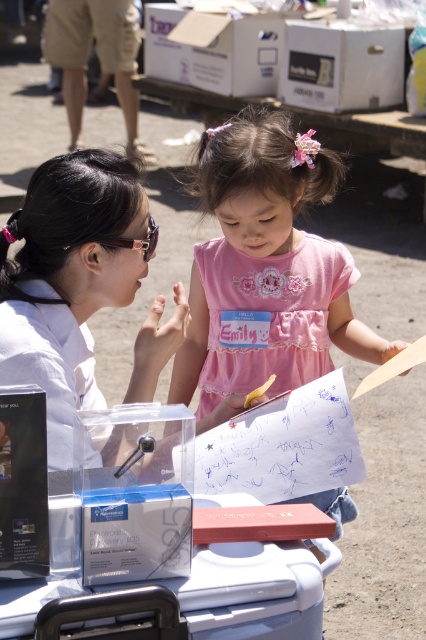
You are a photographer trying to capture a photo of the pink satin dress at center and the matte black goggles at upper left. Given that your camera has a 100mm lens, which has a minimum focusing distance of 1 meter, can you take a clear photo of both objects without moving the camera?

The pink satin dress at center is 17.86 inches from matte black goggles at upper left. Since 17.86 inches is approximately 0.45 meters, which is less than the minimum focusing distance of 1 meter required by the camera lens, you cannot take a clear photo of both objects without moving the camera.